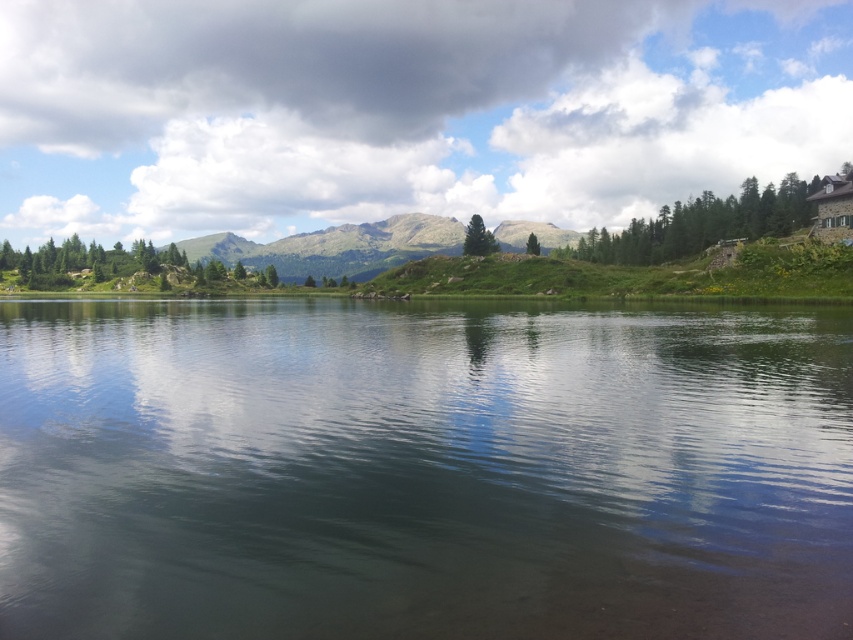
You are planning to build a small garden. You have two options for the location based on the image. One is near the clear water at center and the other is on the green grassy hill at center. Which location has a larger area available for gardening?

The green grassy hill at center has a larger area available for gardening since it is bigger than the clear water at center according to the description.

You are standing at the origin point of the coordinate system. Which direction should you move to reach the clear water at center?

The clear water at center is located at point (421, 470), so you should move towards the right and slightly forward to reach it.